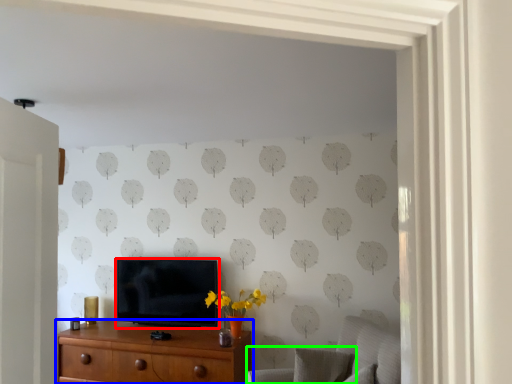
Question: Which object is the closest to the television (highlighted by a red box)? Choose among these: chest of drawers (highlighted by a blue box) or swivel chair (highlighted by a green box).

Choices:
 (A) chest of drawers
 (B) swivel chair

Answer: (A)